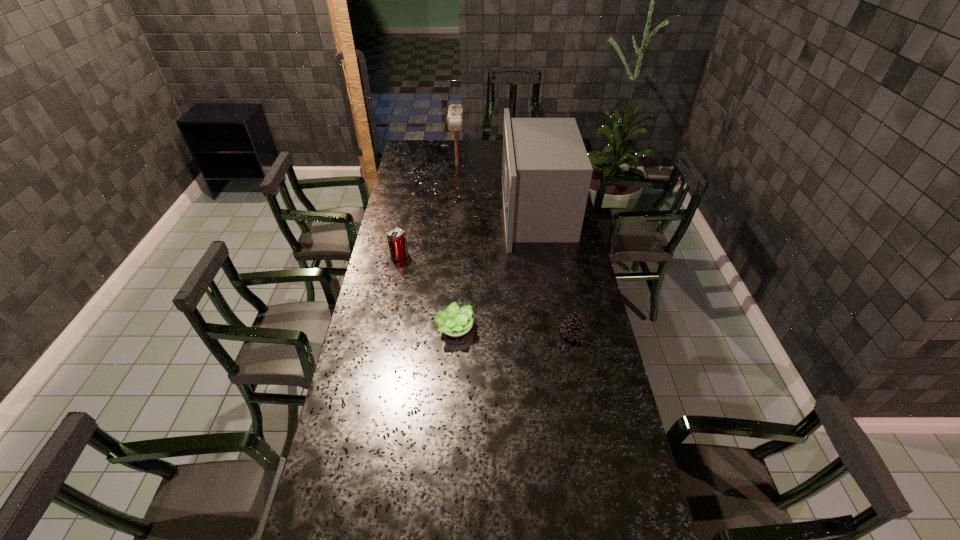
You are a GUI agent. You are given a task and a screenshot of the screen. Output one action in this format:
    pyautogui.click(x=<x>, y=<y>)
    Task: Click on the microwave oven
    The image size is (960, 540).
    Given the screenshot: What is the action you would take?
    (546, 173)

The image size is (960, 540). I want to click on the farthest object, so click(455, 112).

The width and height of the screenshot is (960, 540). Identify the location of mallet. (455, 112).

The image size is (960, 540). Identify the location of the third tallest object. (396, 237).

I want to click on the leftmost object, so click(396, 237).

This screenshot has height=540, width=960. Find the location of `the fourth tallest object`. the fourth tallest object is located at coordinates (573, 327).

Locate an element on the screen. the shortest object is located at coordinates (455, 322).

Where is `vacant area situated on the front-facing side of the tallest object`? The width and height of the screenshot is (960, 540). vacant area situated on the front-facing side of the tallest object is located at coordinates (464, 212).

Identify the location of vacant space located 0.330m on the front-facing side of the tallest object. (432, 212).

Locate an element on the screen. The image size is (960, 540). free location located on the front-facing side of the tallest object is located at coordinates (468, 212).